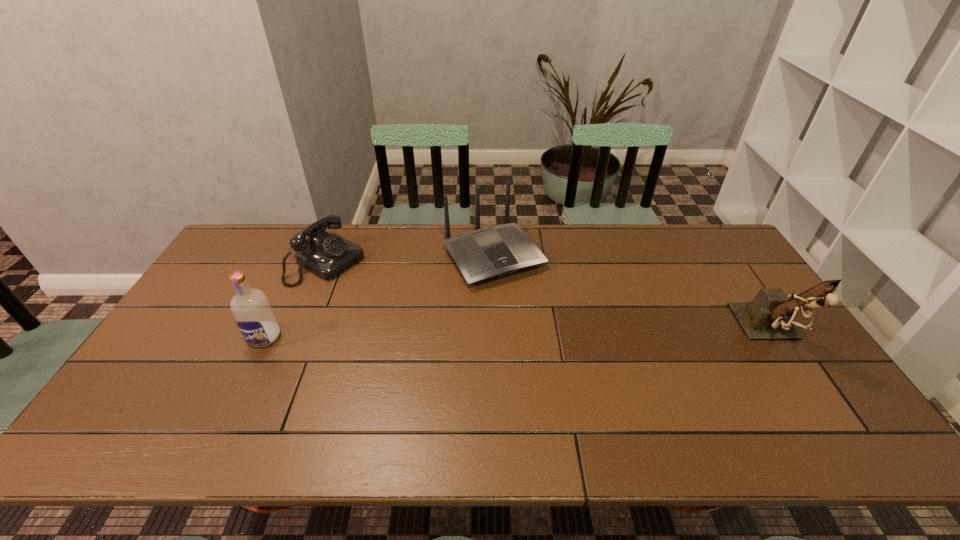
Where is `free spot at the far right corner of the desktop`? free spot at the far right corner of the desktop is located at coordinates (724, 256).

This screenshot has width=960, height=540. What are the coordinates of `vacant area at the near right corner` in the screenshot? It's located at (797, 395).

At what (x,y) coordinates should I click in order to perform the action: click on free point between the telephone and the tallest object. Please return your answer as a coordinate pair (x, y). The width and height of the screenshot is (960, 540). Looking at the image, I should click on (548, 298).

Find the location of `free spot between the third object from left to right and the shortest object`. free spot between the third object from left to right and the shortest object is located at coordinates (410, 260).

Identify the location of unoccupied position between the figurine and the vodka. Image resolution: width=960 pixels, height=540 pixels. (517, 335).

Where is `vacant point located between the vodka and the rightmost object`? This screenshot has height=540, width=960. vacant point located between the vodka and the rightmost object is located at coordinates (517, 335).

This screenshot has height=540, width=960. Find the location of `vacant region between the shortest object and the router`. vacant region between the shortest object and the router is located at coordinates coord(410,260).

I want to click on free space between the router and the shortest object, so click(x=410, y=260).

Identify the location of free spot between the vodka and the figurine. The image size is (960, 540). (517, 335).

At what (x,y) coordinates should I click in order to perform the action: click on free space between the tallest object and the vodka. Please return your answer as a coordinate pair (x, y). Looking at the image, I should click on (x=517, y=335).